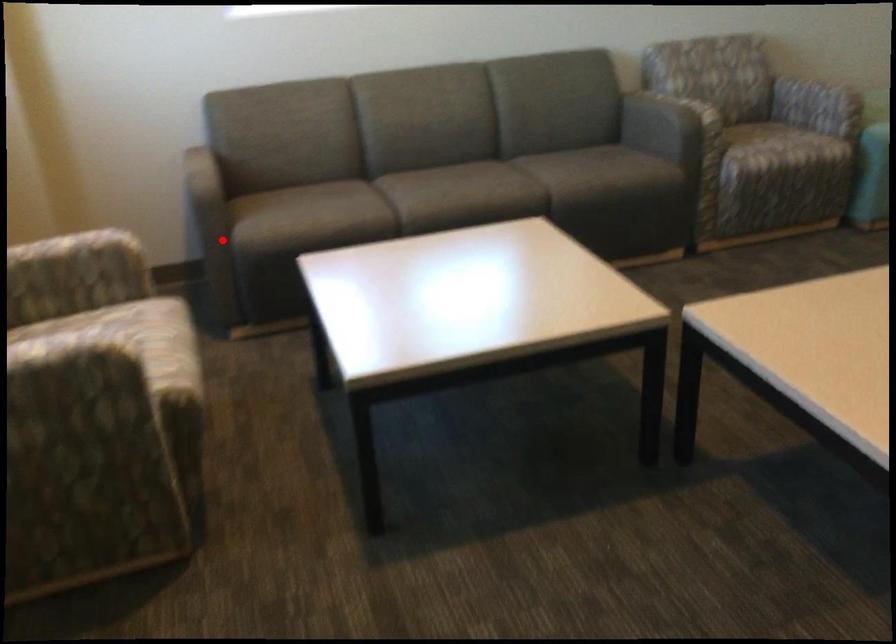
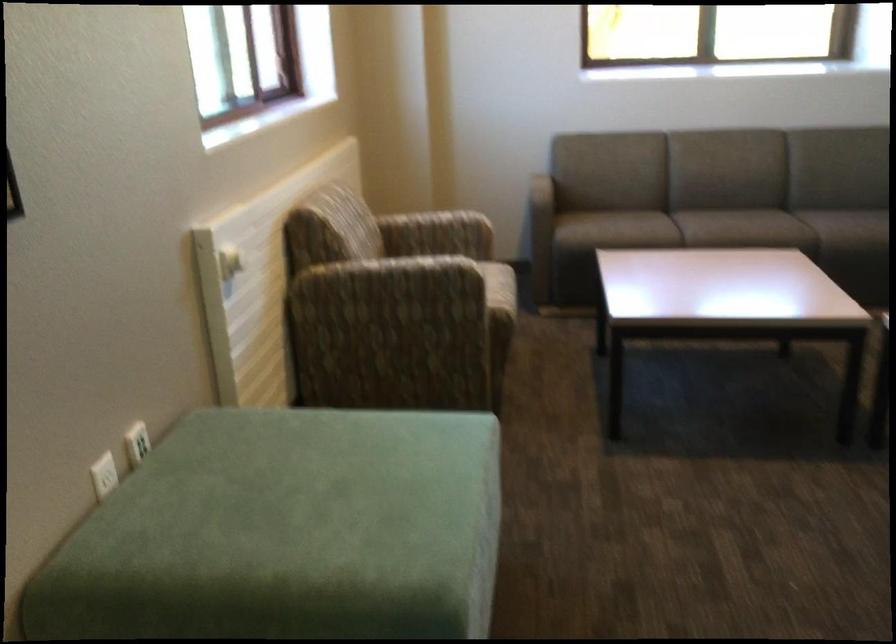
Question: I am providing you with two images of the same scene from different viewpoints. In image1, a red point is highlighted. Considering the same 3D point in image2, which of the following is correct?

Choices:
 (A) It is closer
 (B) It is farther

Answer: (B)